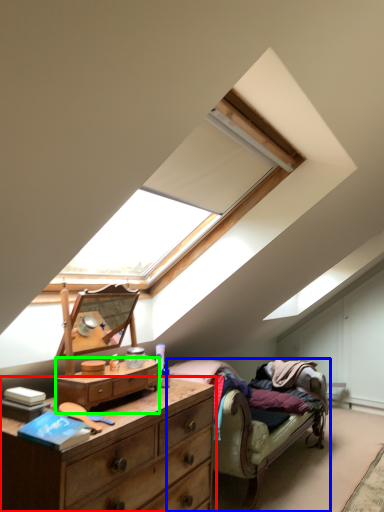
Question: Based on their relative distances, which object is farther from chest of drawers (highlighted by a red box)? Choose from studio couch (highlighted by a blue box) and chest of drawers (highlighted by a green box).

Choices:
 (A) studio couch
 (B) chest of drawers

Answer: (A)